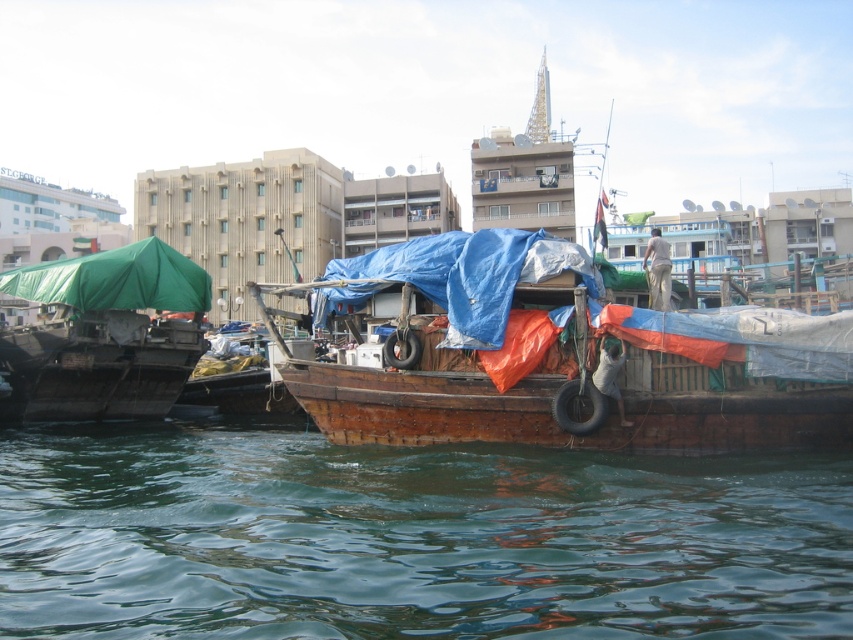
Question: Does green tarpaulin boat at left have a greater width compared to green tarpaulin canopy at left?

Choices:
 (A) no
 (B) yes

Answer: (A)

Question: Where is green water at lower center located in relation to green tarpaulin boat at left in the image?

Choices:
 (A) right
 (B) left

Answer: (A)

Question: Among these points, which one is nearest to the camera?

Choices:
 (A) (90, 285)
 (B) (154, 272)

Answer: (A)

Question: Which of the following is the closest to the observer?

Choices:
 (A) (24, 412)
 (B) (723, 609)
 (C) (186, 275)
 (D) (500, 323)

Answer: (B)

Question: Which point is closer to the camera taking this photo?

Choices:
 (A) (596, 625)
 (B) (53, 285)
 (C) (323, 392)
 (D) (93, 365)

Answer: (A)

Question: Is wooden boat at center bigger than green tarpaulin canopy at left?

Choices:
 (A) no
 (B) yes

Answer: (B)